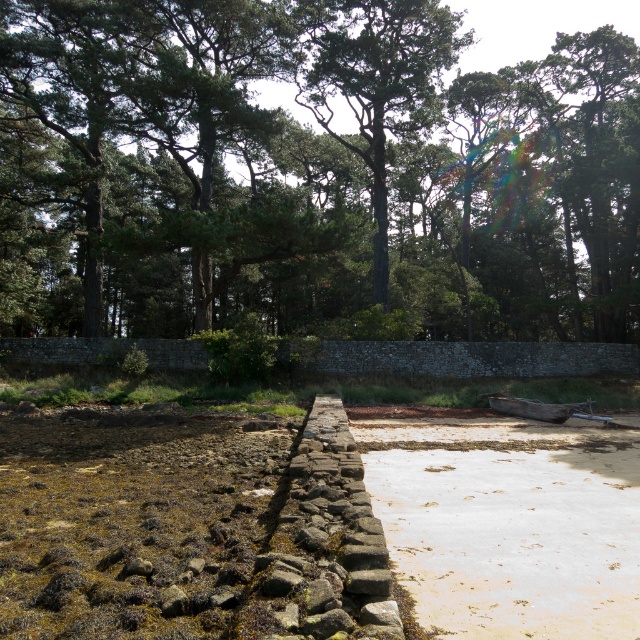
Question: Among these objects, which one is farthest from the camera?

Choices:
 (A) green leafy trees at upper center
 (B) green textured tree at center

Answer: (B)

Question: Which of the following is the farthest from the observer?

Choices:
 (A) green leafy trees at upper center
 (B) weathered wood canoe at center
 (C) smooth concrete path at center

Answer: (A)

Question: Can you confirm if green textured tree at center is bigger than weathered wood canoe at center?

Choices:
 (A) yes
 (B) no

Answer: (A)

Question: Which point appears farthest from the camera in this image?

Choices:
 (A) (333, 58)
 (B) (456, 544)

Answer: (A)

Question: Does green leafy trees at upper center lie behind weathered wood canoe at center?

Choices:
 (A) no
 (B) yes

Answer: (B)

Question: Observing the image, what is the correct spatial positioning of smooth concrete path at center in reference to weathered wood canoe at center?

Choices:
 (A) right
 (B) left

Answer: (B)